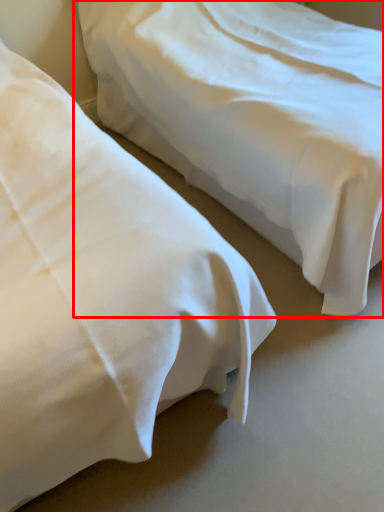
Question: Where is bed (annotated by the red box) located in relation to bed in the image?

Choices:
 (A) right
 (B) left

Answer: (A)